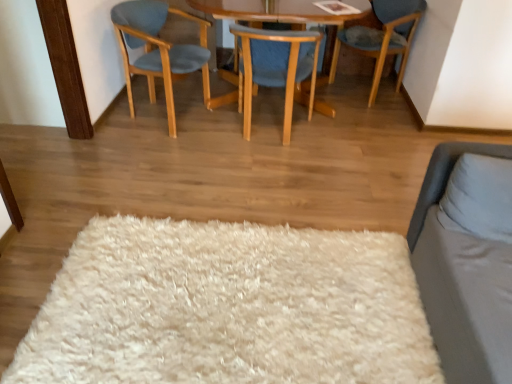
Question: Is light blue fabric chair at left, which is the 3th chair from right to left, positioned before blue fabric chair at upper right, the third chair positioned from the left?

Choices:
 (A) yes
 (B) no

Answer: (A)

Question: Is blue fabric chair at upper right, which is counted as the first chair, starting from the right, at the back of light blue fabric chair at left, which is the 3th chair from right to left?

Choices:
 (A) no
 (B) yes

Answer: (A)

Question: Is light blue fabric chair at left, marked as the 1th chair in a left-to-right arrangement, directly adjacent to blue fabric chair at upper right, the third chair positioned from the left?

Choices:
 (A) no
 (B) yes

Answer: (A)

Question: Considering the relative sizes of light blue fabric chair at left, which is the 3th chair from right to left, and blue fabric chair at upper right, which is counted as the first chair, starting from the right, in the image provided, is light blue fabric chair at left, which is the 3th chair from right to left, taller than blue fabric chair at upper right, which is counted as the first chair, starting from the right,?

Choices:
 (A) yes
 (B) no

Answer: (A)

Question: From a real-world perspective, is light blue fabric chair at left, marked as the 1th chair in a left-to-right arrangement, on blue fabric chair at upper right, which is counted as the first chair, starting from the right?

Choices:
 (A) no
 (B) yes

Answer: (A)

Question: Looking at their shapes, would you say blue fabric chair at upper right, the third chair positioned from the left, is wider or thinner than gray soft pillow at right?

Choices:
 (A) wide
 (B) thin

Answer: (A)

Question: Considering the positions of blue fabric chair at upper right, the third chair positioned from the left, and gray soft pillow at right in the image, is blue fabric chair at upper right, the third chair positioned from the left, bigger or smaller than gray soft pillow at right?

Choices:
 (A) big
 (B) small

Answer: (A)

Question: From their relative heights in the image, would you say blue fabric chair at upper right, which is counted as the first chair, starting from the right, is taller or shorter than gray soft pillow at right?

Choices:
 (A) short
 (B) tall

Answer: (B)

Question: From the image's perspective, is blue fabric chair at upper right, which is counted as the first chair, starting from the right, located above or below gray soft pillow at right?

Choices:
 (A) above
 (B) below

Answer: (A)

Question: Based on their sizes in the image, would you say wooden chair at center, marked as the second chair in a left-to-right arrangement, is bigger or smaller than white fluffy rug at center?

Choices:
 (A) small
 (B) big

Answer: (B)

Question: Considering the positions of wooden chair at center, which ranks as the 2th chair in right-to-left order, and white fluffy rug at center in the image, is wooden chair at center, which ranks as the 2th chair in right-to-left order, wider or thinner than white fluffy rug at center?

Choices:
 (A) wide
 (B) thin

Answer: (B)

Question: Is wooden chair at center, which ranks as the 2th chair in right-to-left order, in front of or behind white fluffy rug at center in the image?

Choices:
 (A) behind
 (B) front

Answer: (A)

Question: Is wooden chair at center, which ranks as the 2th chair in right-to-left order, situated inside white fluffy rug at center or outside?

Choices:
 (A) outside
 (B) inside

Answer: (A)

Question: In terms of size, does white fluffy rug at center appear bigger or smaller than blue fabric chair at upper right, which is counted as the first chair, starting from the right?

Choices:
 (A) big
 (B) small

Answer: (B)

Question: From a real-world perspective, is white fluffy rug at center positioned above or below blue fabric chair at upper right, which is counted as the first chair, starting from the right?

Choices:
 (A) above
 (B) below

Answer: (B)